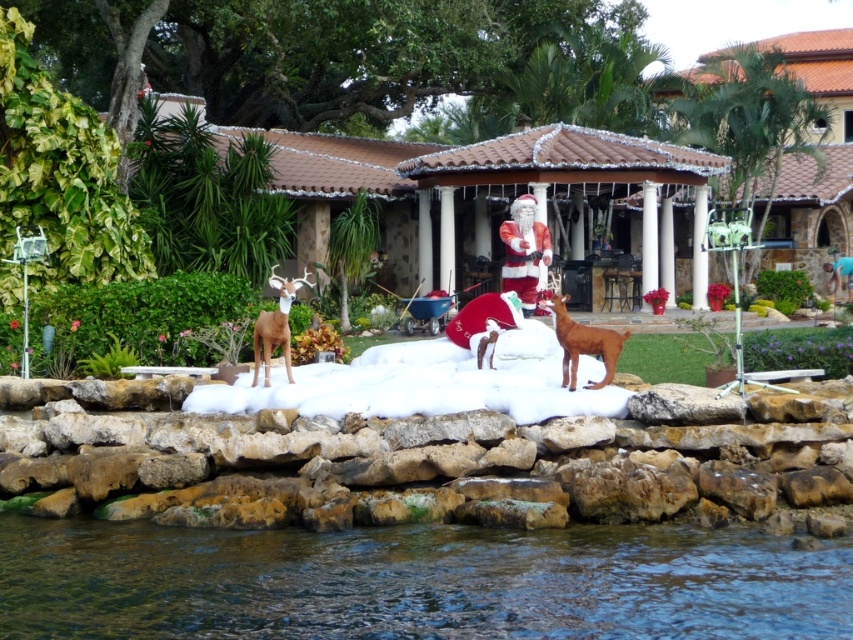
You are a dog owner who wants to walk your brown matte dog at center on the clear water at lower center. Is the water wide enough for the dog to walk across?

The clear water at lower center might be wider than the brown matte dog at center, so it is uncertain if the dog can cross safely. Check the actual width before proceeding.

You are a visitor at the festive outdoor scene and want to take a photo of the clear water at lower center and the matte red santa at center. Since you want to capture both in one frame, where should you position yourself relative to the two objects?

You should position yourself to the right side of the clear water at lower center and to the left side of the matte red santa at center because the clear water at lower center is on the left side of the matte red santa at center.